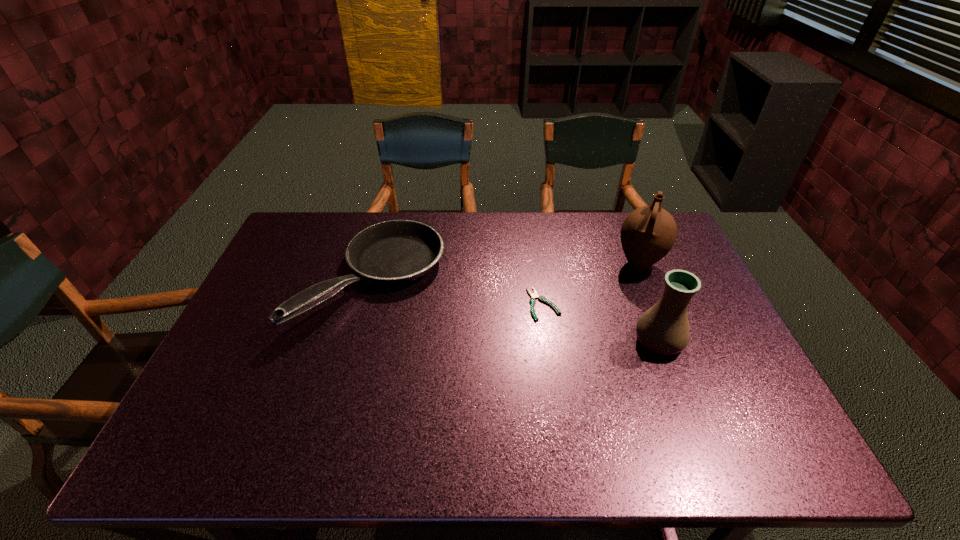
The image size is (960, 540). What are the coordinates of `pitcher that is at the far edge` in the screenshot? It's located at (648, 233).

The image size is (960, 540). I want to click on frying pan that is positioned at the far edge, so click(397, 251).

You are a GUI agent. You are given a task and a screenshot of the screen. Output one action in this format:
    pyautogui.click(x=<x>, y=<y>)
    Task: Click on the object present at the left edge
    This screenshot has height=540, width=960.
    Given the screenshot: What is the action you would take?
    pyautogui.click(x=397, y=251)

Where is `pitcher that is at the right edge`? The width and height of the screenshot is (960, 540). pitcher that is at the right edge is located at coordinates (648, 233).

Locate an element on the screen. pottery present at the right edge is located at coordinates (664, 329).

Where is `object present at the far left corner`? The image size is (960, 540). object present at the far left corner is located at coordinates (397, 251).

Locate an element on the screen. object present at the far right corner is located at coordinates (648, 233).

Locate an element on the screen. free space at the far edge of the desktop is located at coordinates (588, 246).

At what (x,y) coordinates should I click in order to perform the action: click on vacant space at the near edge of the desktop. Please return your answer as a coordinate pair (x, y). Looking at the image, I should click on (533, 437).

Where is `free space at the left edge of the desktop`? The width and height of the screenshot is (960, 540). free space at the left edge of the desktop is located at coordinates (291, 269).